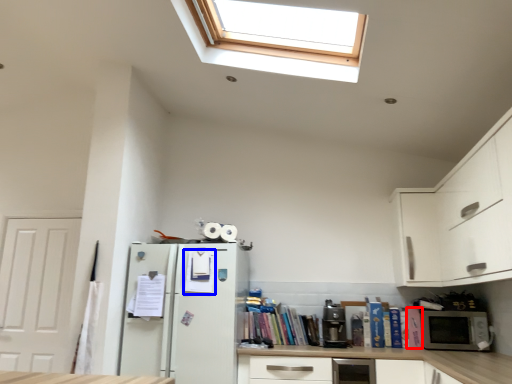
Question: Which point is closer to the camera, book (highlighted by a red box) or book (highlighted by a blue box)?

Choices:
 (A) book
 (B) book

Answer: (B)